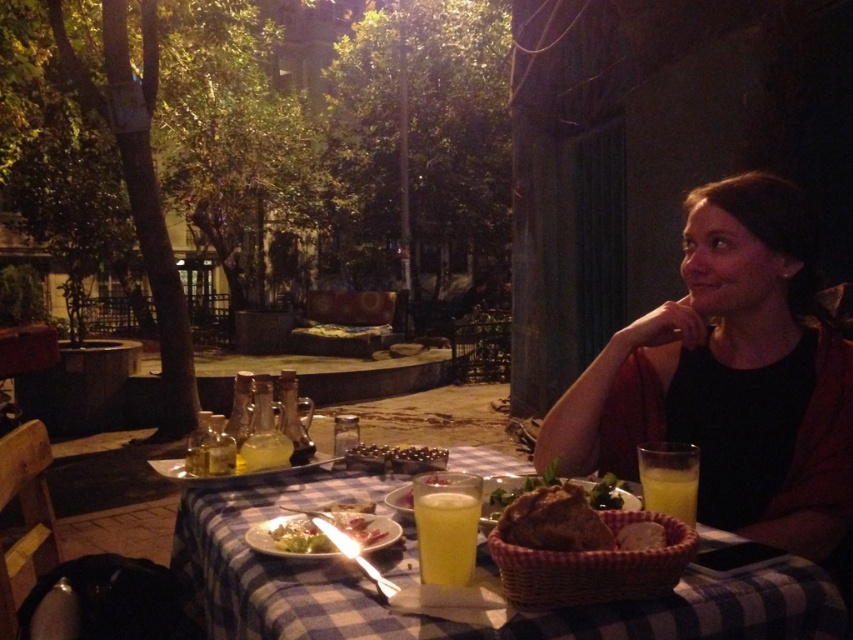
Looking at this image, you are a waiter at the restaurant and need to place a new drink order on the table. The plastic basket at center is in the way. Which direction should you move the black matte shirt at center to make space?

The black matte shirt at center is to the right of the plastic basket at center. To make space, you should move the black matte shirt at center to the left.

You are standing at the edge of the patio and want to greet the person wearing the black matte shirt at center. Which direction should you walk to approach them?

Since the black matte shirt at center is located at point 0.591 on the x axis and 0.858 on the y axis, you should walk towards the center of the patio to reach them.